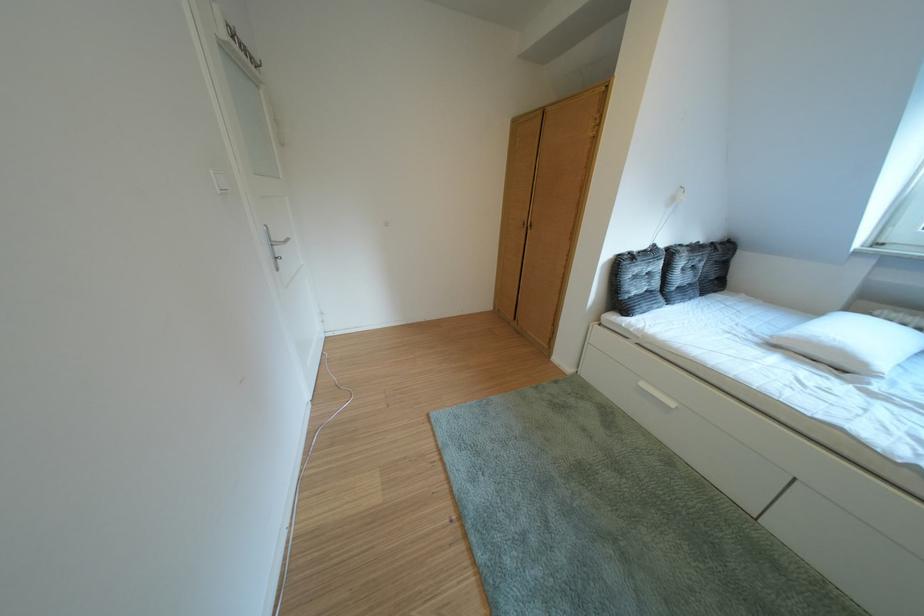
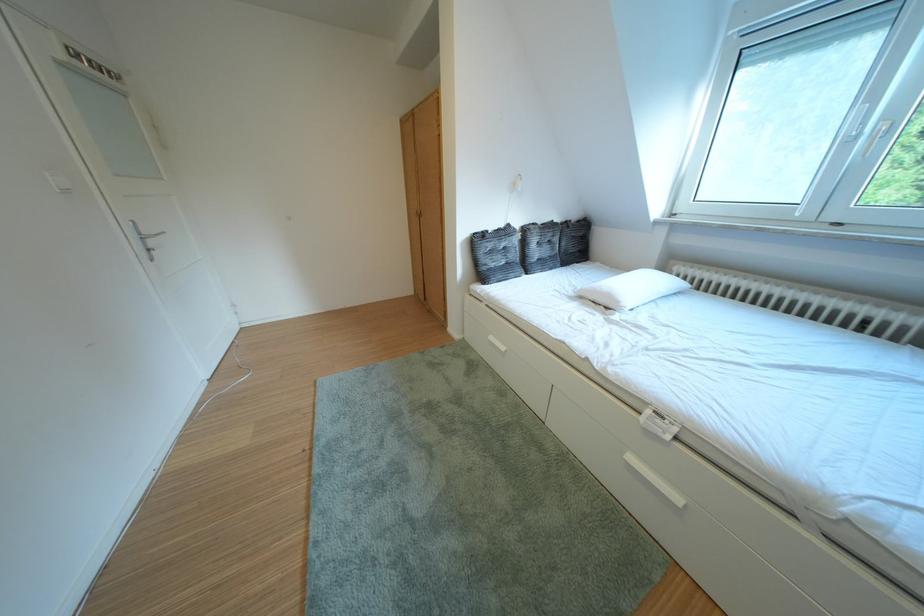
The point at (734, 243) is marked in the first image. Where is the corresponding point in the second image?

(588, 222)